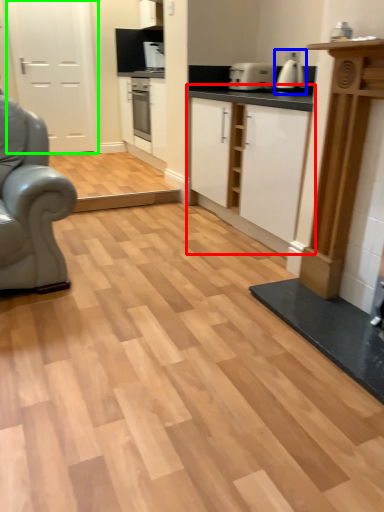
Question: Which object is the farthest from cabinetry (highlighted by a red box)? Choose among these: coffee machine (highlighted by a blue box) or door (highlighted by a green box).

Choices:
 (A) coffee machine
 (B) door

Answer: (B)